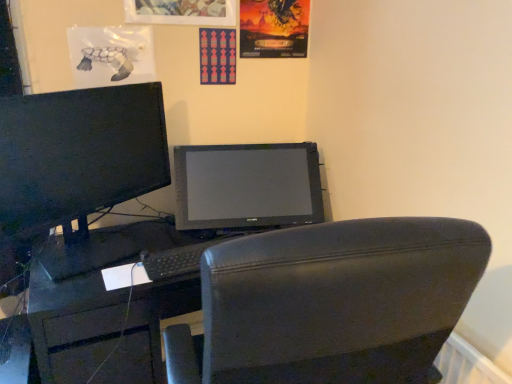
Where is `vacant area on top of black matte keyboard at center (from a real-world perspective)`? vacant area on top of black matte keyboard at center (from a real-world perspective) is located at coordinates (175, 253).